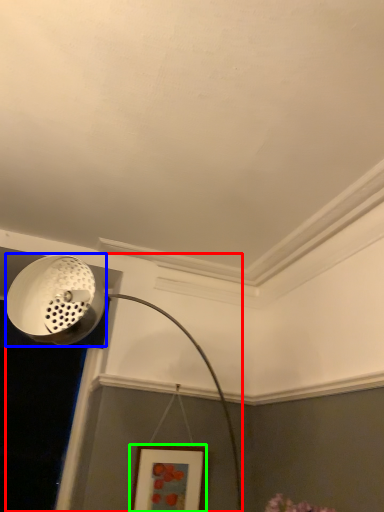
Question: Considering the real-world distances, which object is closest to lamp (highlighted by a red box)? light fixture (highlighted by a blue box) or picture frame (highlighted by a green box).

Choices:
 (A) light fixture
 (B) picture frame

Answer: (A)